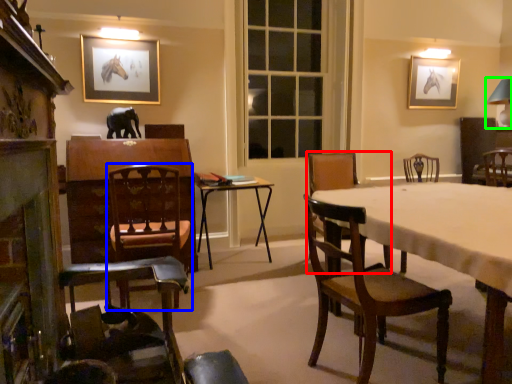
Question: Which object is positioned closest to chair (highlighted by a red box)? Select from chair (highlighted by a blue box) and table lamp (highlighted by a green box).

Choices:
 (A) chair
 (B) table lamp

Answer: (A)